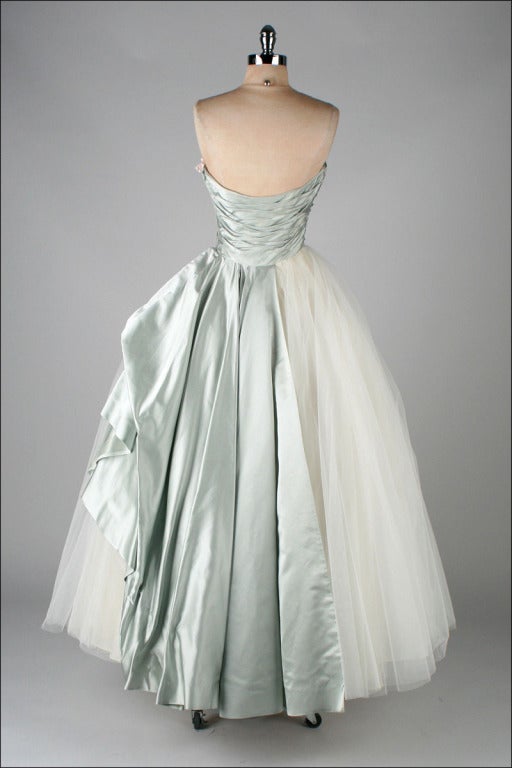
Find the location of a particular element. This screenshot has height=768, width=512. flooring gray is located at coordinates (276, 749).